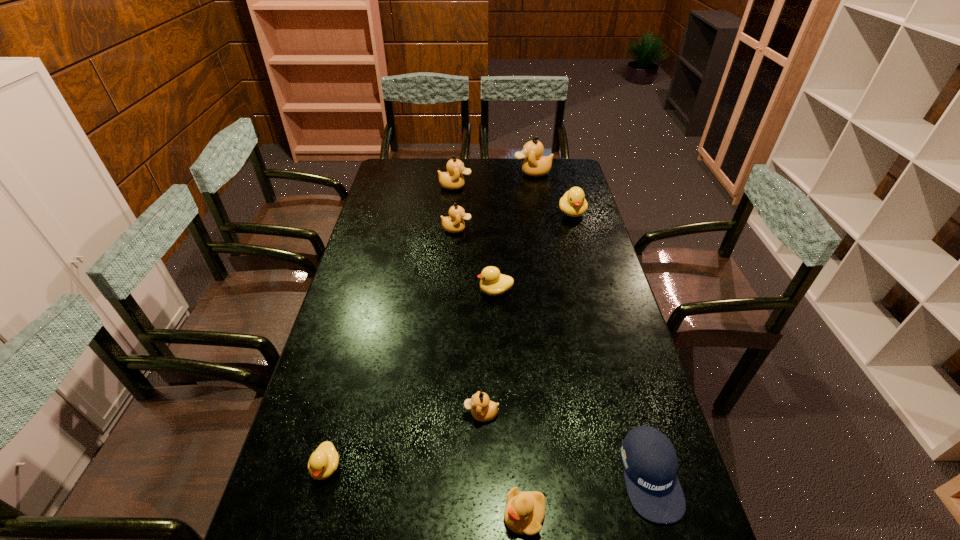
Identify the location of vacant space located on the beak of the leftmost yellow duckling. (311, 524).

Locate an element on the screen. This screenshot has height=540, width=960. object that is positioned at the left edge is located at coordinates (324, 460).

The width and height of the screenshot is (960, 540). I want to click on baseball cap at the right edge, so click(x=650, y=464).

Where is `object located in the far right corner section of the desktop`? object located in the far right corner section of the desktop is located at coordinates (535, 164).

This screenshot has width=960, height=540. In order to click on free region at the far edge in this screenshot , I will do `click(512, 174)`.

Identify the location of vacant area at the left edge. (400, 241).

Identify the location of blank space at the right edge of the desktop. (595, 386).

I want to click on empty space between the rightmost yellow duckling and the nearest yellow duckling, so click(548, 364).

This screenshot has height=540, width=960. Find the location of `free space between the fourth nearest duckling and the eighth nearest object`. free space between the fourth nearest duckling and the eighth nearest object is located at coordinates (475, 238).

Identify the location of free space between the blue baseball cap and the third biggest tan duckling. (553, 352).